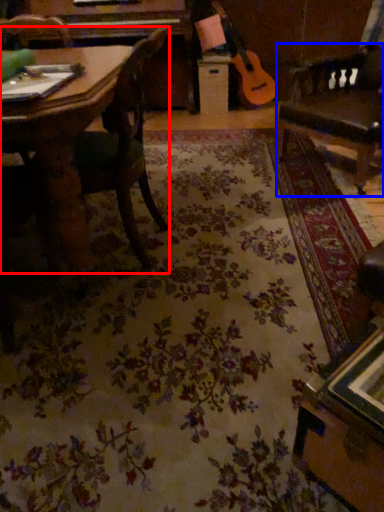
Question: Which point is closer to the camera, chair (highlighted by a red box) or swivel chair (highlighted by a blue box)?

Choices:
 (A) chair
 (B) swivel chair

Answer: (A)